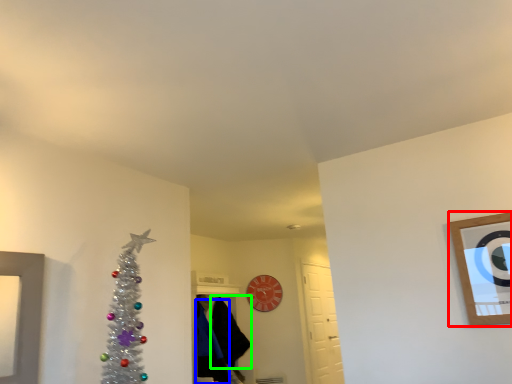
Question: Considering the real-world distances, which object is closest to picture frame (highlighted by a red box)? robe (highlighted by a blue box) or robe (highlighted by a green box).

Choices:
 (A) robe
 (B) robe

Answer: (B)